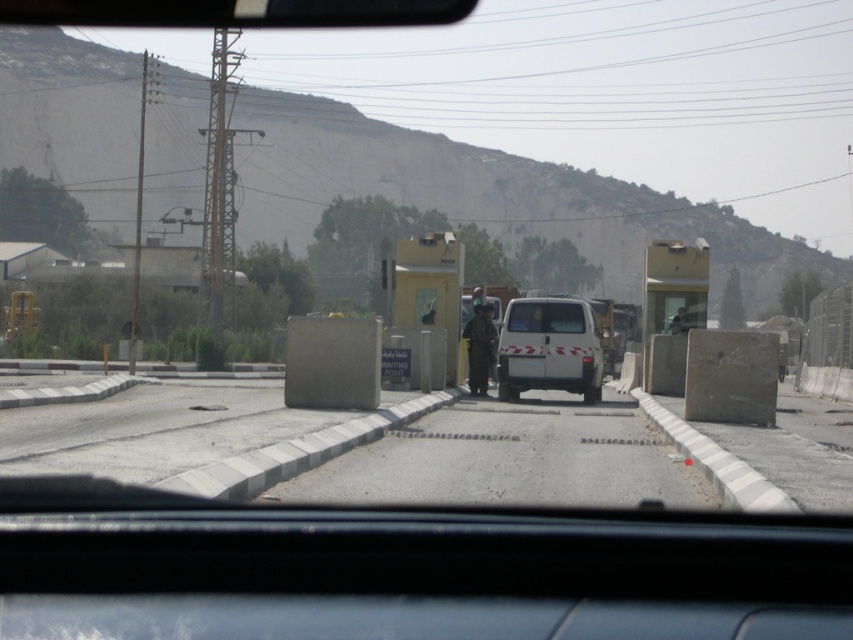
Does clear glass windshield at center have a greater height compared to camouflage uniform at center?

Yes, clear glass windshield at center is taller than camouflage uniform at center.

Is point (527, 301) behind point (476, 333)?

That is False.

Image resolution: width=853 pixels, height=640 pixels. Find the location of `clear glass windshield at center`. clear glass windshield at center is located at coordinates (544, 316).

Is point (524, 362) positioned after point (469, 324)?

No, it is not.

Does white matte van at center have a smaller size compared to camouflage uniform at center?

Actually, white matte van at center might be larger than camouflage uniform at center.

Who is more forward, (509, 365) or (473, 371)?

Point (509, 365)

Identify the location of white matte van at center. The height and width of the screenshot is (640, 853). 549,348.

Between white matte van at center and clear glass windshield at center, which one has less height?

clear glass windshield at center

Can you confirm if white matte van at center is taller than clear glass windshield at center?

Yes, white matte van at center is taller than clear glass windshield at center.

Locate an element on the screen. This screenshot has width=853, height=640. white matte van at center is located at coordinates (549, 348).